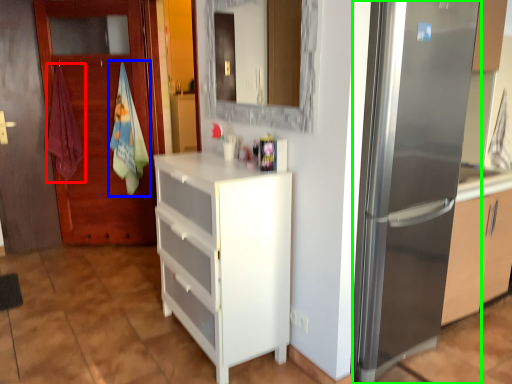
Question: Which is nearer to the beach towel (highlighted by a red box)? beach towel (highlighted by a blue box) or refrigerator (highlighted by a green box).

Choices:
 (A) beach towel
 (B) refrigerator

Answer: (A)